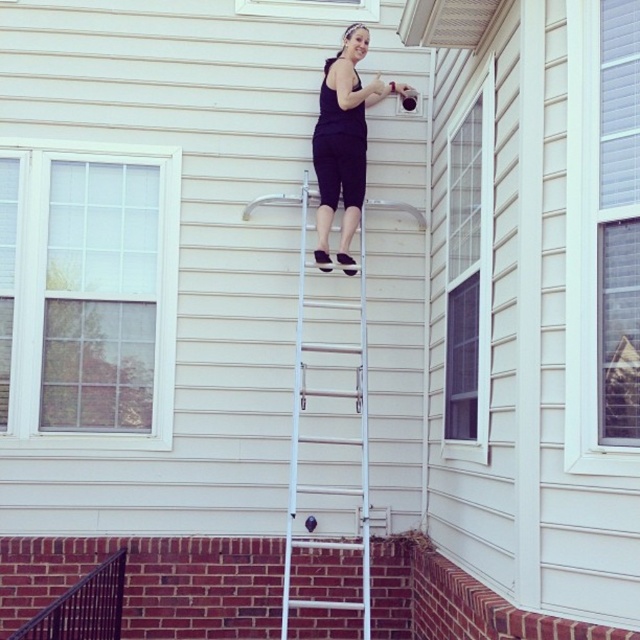
You are a painter trying to reach a high window on a house. You see the white metallic ladder at center and the black matte pants at upper center. Which object is closer to the ground?

The white metallic ladder at center is located below the black matte pants at upper center, meaning it is closer to the ground.